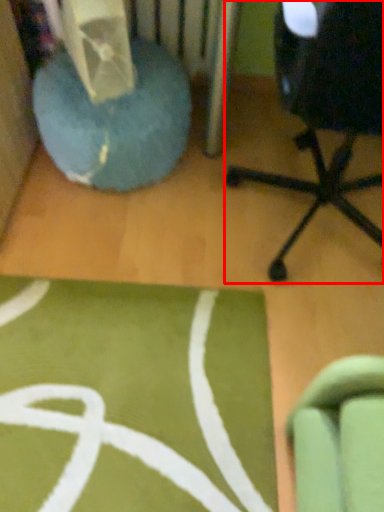
Question: From the image's perspective, what is the correct spatial relationship of chair (annotated by the red box) in relation to bean bag chair?

Choices:
 (A) below
 (B) above

Answer: (A)